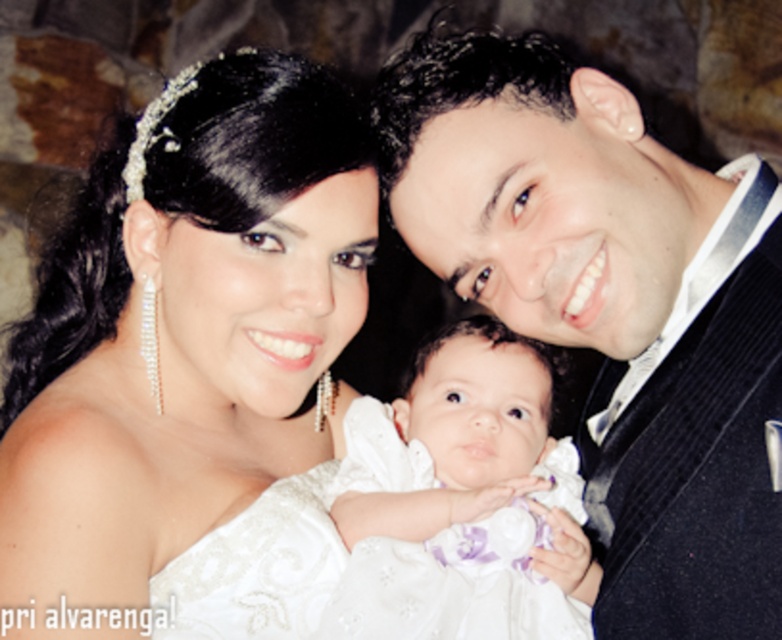
Can you confirm if white satin dress at upper left is positioned above white satin dress at center?

Yes, white satin dress at upper left is above white satin dress at center.

Describe the element at coordinates (189, 368) in the screenshot. I see `white satin dress at upper left` at that location.

Does point (181, 524) come closer to viewer compared to point (533, 468)?

Yes, point (181, 524) is closer to viewer.

Find the location of a particular element. white satin dress at upper left is located at coordinates (189, 368).

In the scene shown: Is white satin dress at upper left closer to camera compared to satin black suit at upper right?

No, white satin dress at upper left is behind satin black suit at upper right.

Between point (230, 625) and point (773, 348), which one is positioned in front?

Positioned in front is point (773, 348).

Find the location of a particular element. This screenshot has height=640, width=782. white satin dress at upper left is located at coordinates [189, 368].

Does white satin dress at center have a lesser height compared to clear crystal tiara at upper center?

No, white satin dress at center is not shorter than clear crystal tiara at upper center.

Does white satin dress at center appear under clear crystal tiara at upper center?

Yes, white satin dress at center is below clear crystal tiara at upper center.

Is point (348, 500) positioned in front of point (192, 68)?

No, it is not.

In order to click on white satin dress at center in this screenshot , I will do `click(458, 499)`.